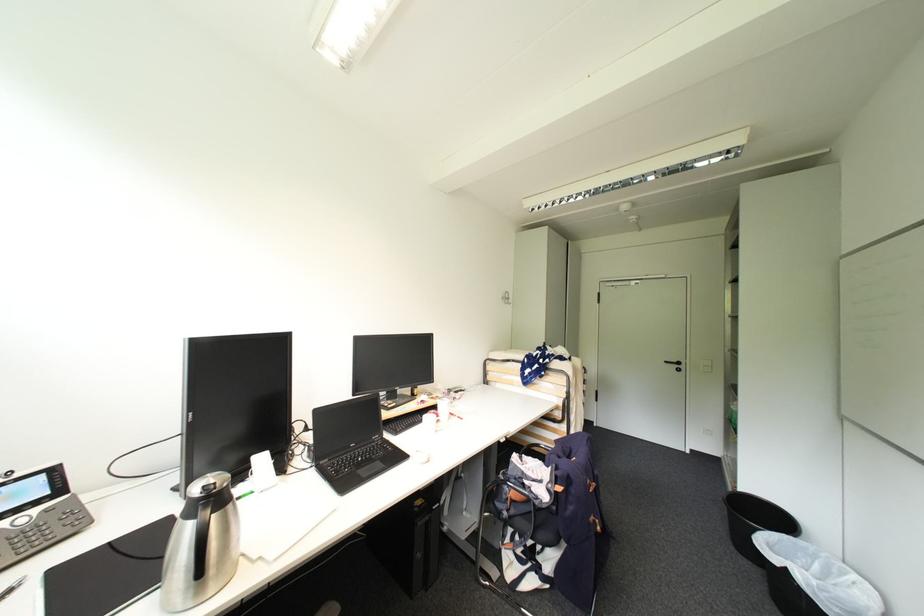
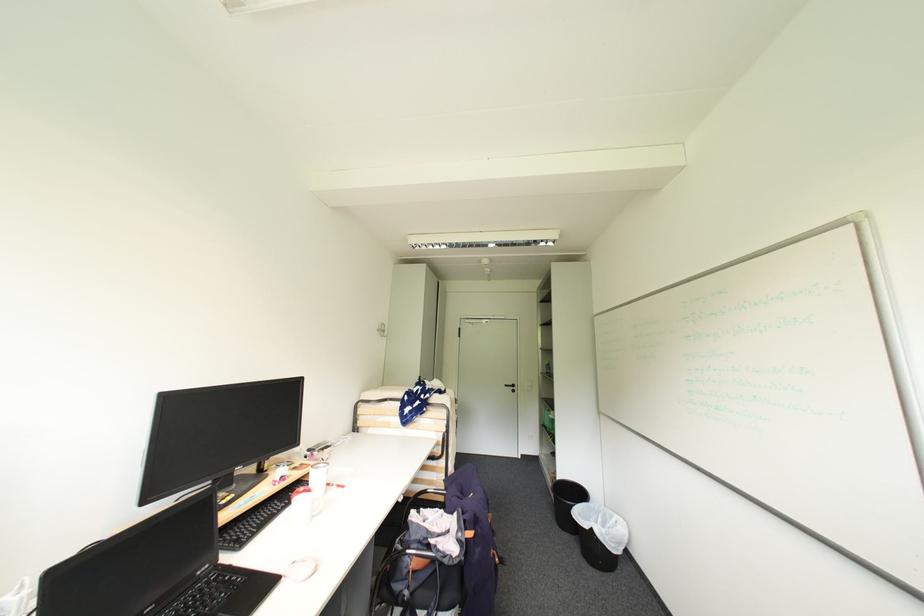
Find the pixel in the second image that matches (795,538) in the first image.

(591, 505)